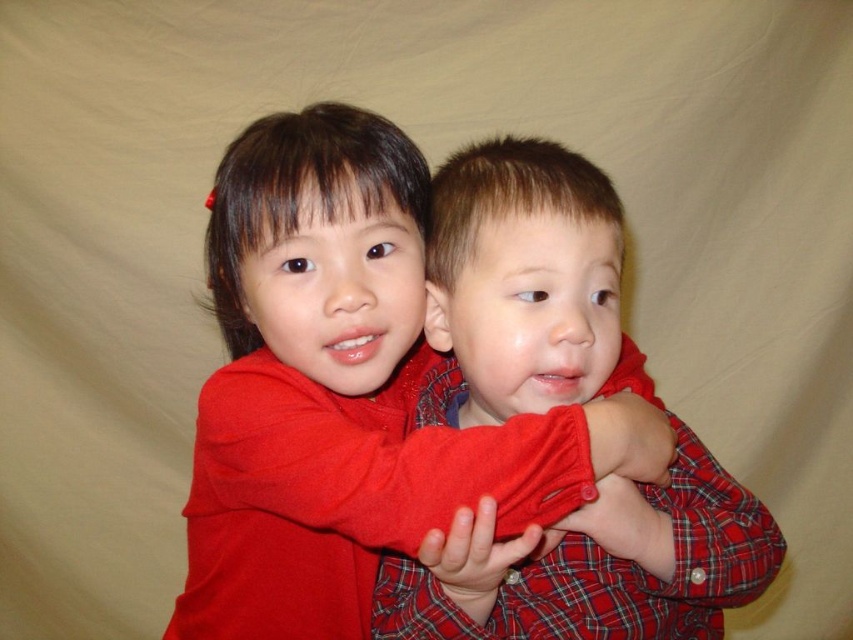
Can you confirm if matte red sweater at center is thinner than plaid fabric shirt at center?

Result: No, matte red sweater at center is not thinner than plaid fabric shirt at center.

Is matte red sweater at center wider than plaid fabric shirt at center?

Indeed, matte red sweater at center has a greater width compared to plaid fabric shirt at center.

Identify the location of matte red sweater at center. (346, 392).